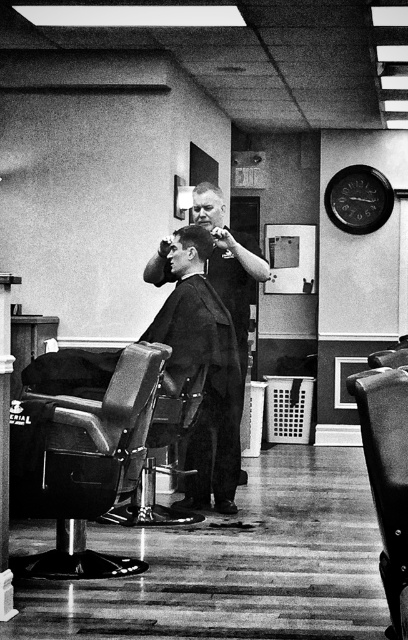
Question: Which object is positioned farthest from the metallic black barber chair at left?

Choices:
 (A) smooth black barber at center
 (B) metallic leather chair at right
 (C) short dark hair at center

Answer: (A)

Question: Considering the relative positions of smooth black barber at center and short dark hair at center in the image provided, where is smooth black barber at center located with respect to short dark hair at center?

Choices:
 (A) below
 (B) above

Answer: (A)

Question: Which of these objects is positioned farthest from the metallic leather chair at right?

Choices:
 (A) smooth black barber at center
 (B) short curly hair at center
 (C) smooth black barber chair at center

Answer: (B)

Question: Is metallic polished barber chair at center above short dark hair at center?

Choices:
 (A) no
 (B) yes

Answer: (A)

Question: Which object appears closest to the camera in this image?

Choices:
 (A) metallic black barber chair at left
 (B) short curly hair at center
 (C) short dark hair at center
 (D) smooth black barber chair at center

Answer: (A)

Question: Is metallic black barber chair at left wider than short curly hair at center?

Choices:
 (A) yes
 (B) no

Answer: (A)